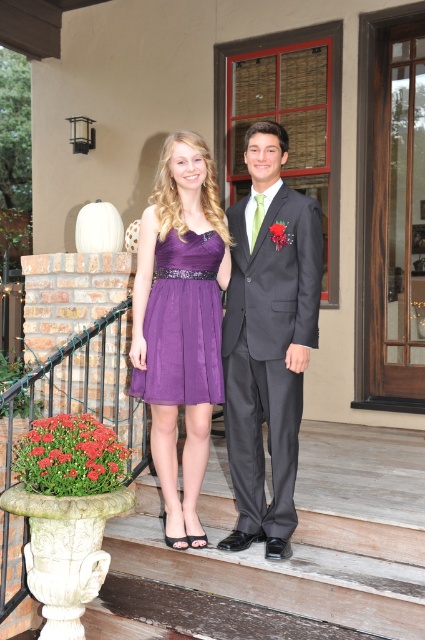
Which is behind, point (163, 445) or point (209, 397)?

Point (163, 445)

Which of these two, purple satin dress at center or purple chiffon dress at center, stands shorter?

purple chiffon dress at center

Identify the location of purple satin dress at center. This screenshot has width=425, height=640. (181, 323).

Measure the distance between point (261,291) and camera.

Point (261,291) is 3.21 meters away from camera.

Is point (246, 220) farther from viewer compared to point (197, 515)?

No, it is in front of (197, 515).

Find the location of a particular element. Image resolution: width=425 pixels, height=640 pixels. charcoal gray suit at center is located at coordinates (268, 339).

You are a GUI agent. You are given a task and a screenshot of the screen. Output one action in this format:
    pyautogui.click(x=<x>, y=<y>)
    Task: Click on the charcoal gray suit at center
    
    Given the screenshot: What is the action you would take?
    pyautogui.click(x=268, y=339)

Can you confirm if charcoal gray suit at center is positioned above purple chiffon dress at center?

No.

Between charcoal gray suit at center and purple chiffon dress at center, which one appears on the left side from the viewer's perspective?

From the viewer's perspective, purple chiffon dress at center appears more on the left side.

What do you see at coordinates (268, 339) in the screenshot? I see `charcoal gray suit at center` at bounding box center [268, 339].

Find the location of a particular element. charcoal gray suit at center is located at coordinates (268, 339).